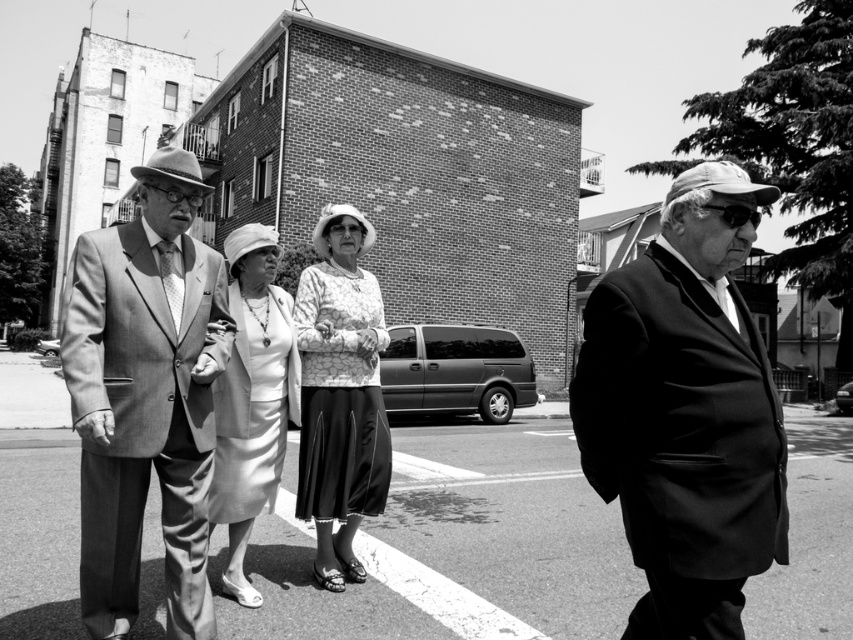
Is patterned fabric dress at center smaller than matte white dress at center?

Yes, patterned fabric dress at center is smaller than matte white dress at center.

Is patterned fabric dress at center below matte white dress at center?

No.

Is point (300, 460) closer to camera compared to point (219, 444)?

No, (300, 460) is behind (219, 444).

Find the location of a particular element. patterned fabric dress at center is located at coordinates (340, 394).

Between smooth black suit at center and patterned fabric dress at center, which one is positioned lower?

smooth black suit at center is below.

Is point (665, 284) less distant than point (370, 401)?

That is True.

Locate an element on the screen. smooth black suit at center is located at coordinates (686, 412).

Which is in front, point (714, 432) or point (241, 483)?

Point (714, 432) is in front.

Is point (636, 392) positioned after point (230, 248)?

No, it is in front of (230, 248).

You are a GUI agent. You are given a task and a screenshot of the screen. Output one action in this format:
    pyautogui.click(x=<x>, y=<y>)
    Task: Click on the smooth black suit at center
    The width and height of the screenshot is (853, 640).
    Given the screenshot: What is the action you would take?
    pyautogui.click(x=686, y=412)